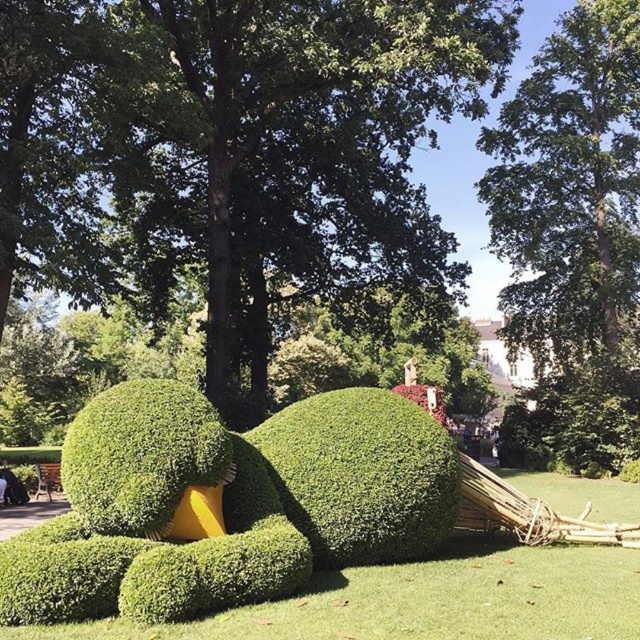
Question: Considering the real-world distances, which object is closest to the green leafy bush at center?

Choices:
 (A) green leafy tree at upper center
 (B) green grass at center
 (C) green leafy tree at center

Answer: (B)

Question: Is the position of green grass at center less distant than that of green leafy bush at center?

Choices:
 (A) yes
 (B) no

Answer: (A)

Question: Does green leafy tree at upper center appear over green grass at center?

Choices:
 (A) no
 (B) yes

Answer: (B)

Question: Considering the real-world distances, which object is closest to the green leafy bush at center?

Choices:
 (A) green leafy tree at upper center
 (B) green bushy hedge at center

Answer: (B)

Question: Can you confirm if green leafy tree at center is positioned to the left of green grass at center?

Choices:
 (A) no
 (B) yes

Answer: (B)

Question: Which point is farther from the camera taking this photo?

Choices:
 (A) (88, 433)
 (B) (576, 76)

Answer: (B)